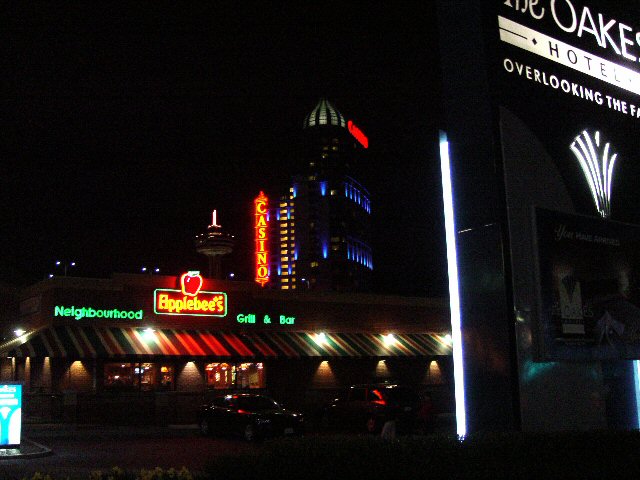
At what (x,y) coordinates should I click in order to perform the action: click on window. Please return your answer as a coordinate pair (x, y). The height and width of the screenshot is (480, 640). Looking at the image, I should click on (349, 254).